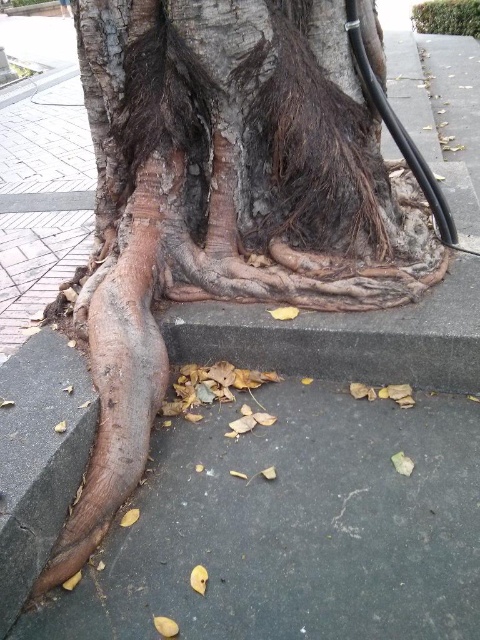
You are a gardener trying to place a decorative stone on the brown rough pavement at lower left. The stone is as wide as the brown rough bark at center. Will it fit on the pavement?

The brown rough pavement at lower left is wider than the brown rough bark at center. Since the stone is as wide as the brown rough bark at center, it will fit on the pavement.

You are standing at the point marked by the coordinates point (158, 612). You want to place a small potted plant exactly 1 meter away from your current position. Is there enough space on the paved area around the tree to do this?

The distance between point (158, 612) and the viewer is 1.15 meters, so placing a plant 1 meter away is possible as there is sufficient space on the paved area around the tree.

You are standing at the center of the tree base and want to step onto the brown rough pavement at lower left. Which direction should you move to reach it?

You should move toward the lower left direction to reach the brown rough pavement at lower left.